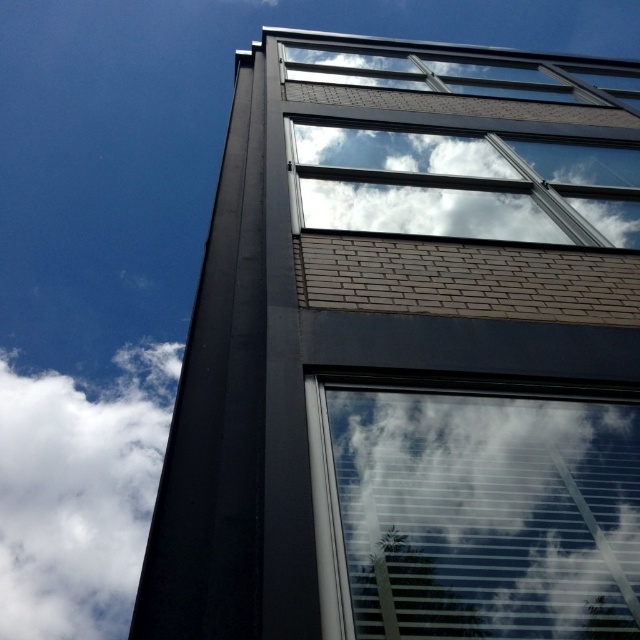
Question: Estimate the real-world distances between objects in this image. Which object is closer to the white fluffy cloud at upper left?

Choices:
 (A) transparent glass window at center
 (B) white cloud at upper center

Answer: (B)

Question: Considering the relative positions of transparent glass window at center and white cloud at upper center in the image provided, where is transparent glass window at center located with respect to white cloud at upper center?

Choices:
 (A) right
 (B) left

Answer: (B)

Question: Estimate the real-world distances between objects in this image. Which object is farther from the white cloud at upper center?

Choices:
 (A) transparent glass window at center
 (B) white fluffy cloud at upper left

Answer: (B)

Question: Does transparent glass window at center appear under white fluffy cloud at upper left?

Choices:
 (A) yes
 (B) no

Answer: (B)

Question: Does transparent glass window at center have a greater width compared to white fluffy cloud at upper left?

Choices:
 (A) no
 (B) yes

Answer: (A)

Question: Which object is farther from the camera taking this photo?

Choices:
 (A) white fluffy cloud at upper left
 (B) transparent glass window at center
 (C) white cloud at upper center

Answer: (A)